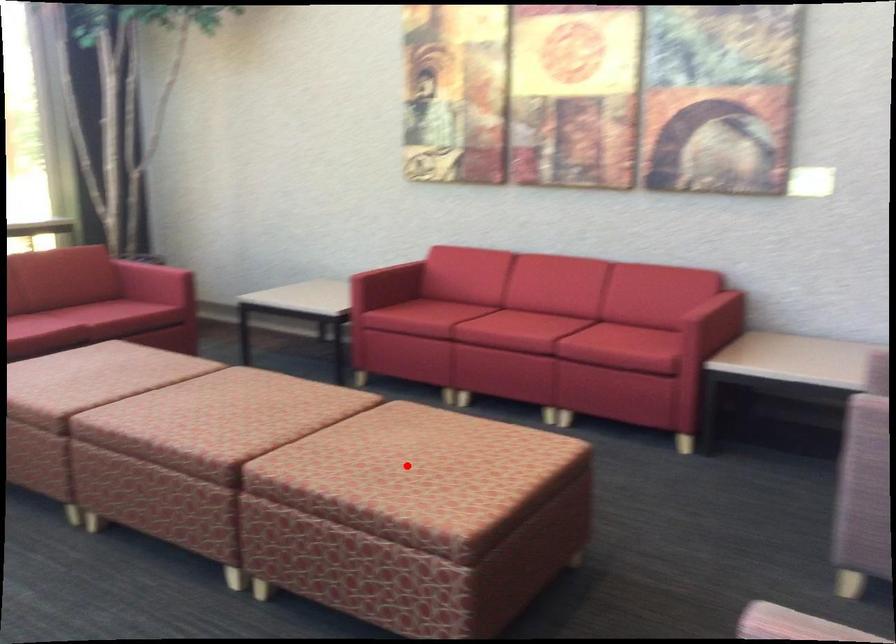
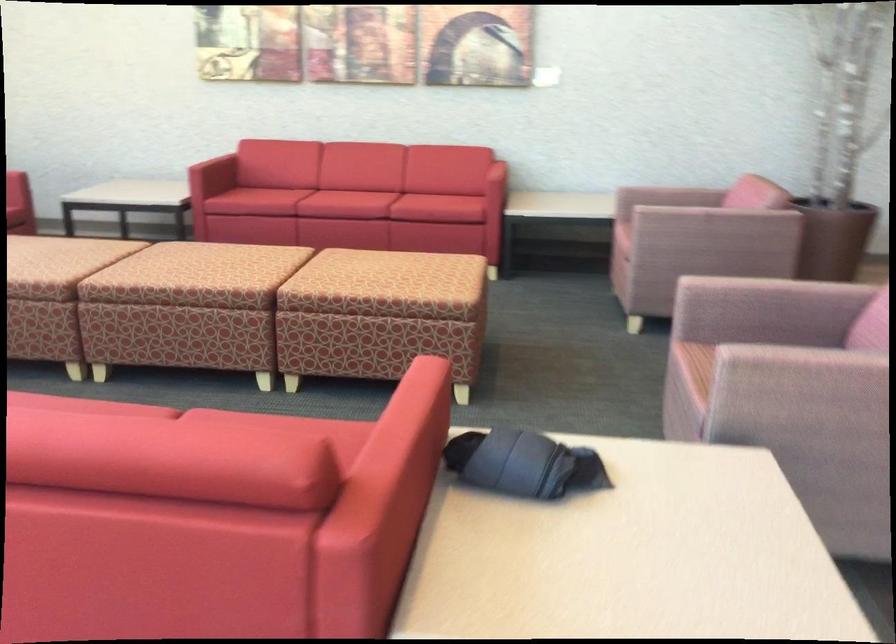
Locate, in the second image, the point that corresponds to the highlighted location in the first image.

(385, 270)